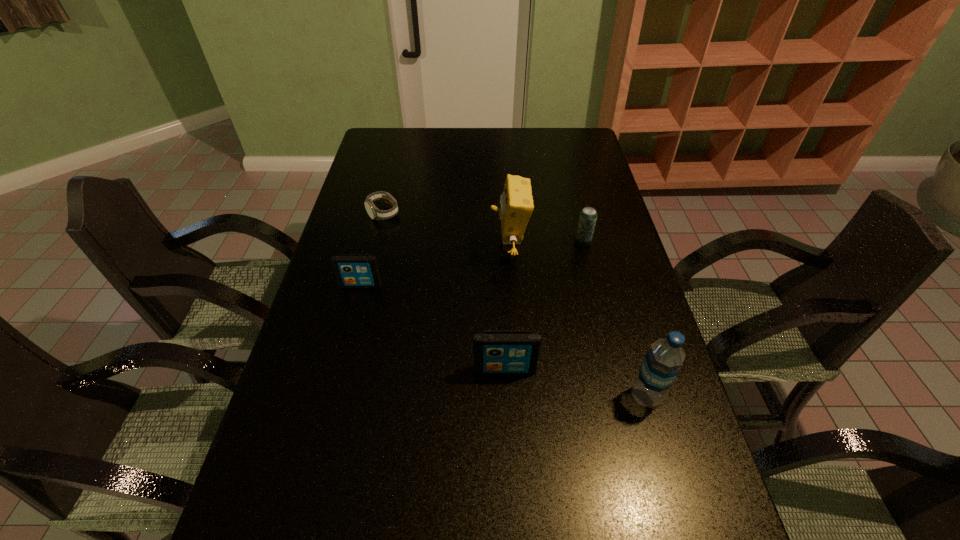
The height and width of the screenshot is (540, 960). I want to click on free point located 0.180m on the back of the beer can, so click(x=573, y=203).

Where is `free point located 0.300m on the face of the sponge`? Image resolution: width=960 pixels, height=540 pixels. free point located 0.300m on the face of the sponge is located at coordinates (392, 251).

You are a GUI agent. You are given a task and a screenshot of the screen. Output one action in this format:
    pyautogui.click(x=<x>, y=<y>)
    Task: Click on the vacant space located on the face of the sponge
    The height and width of the screenshot is (540, 960).
    Given the screenshot: What is the action you would take?
    pyautogui.click(x=366, y=251)

At what (x,y) coordinates should I click in order to perform the action: click on free space located 0.320m on the face of the sponge. Please return your answer as a coordinate pair (x, y). Looking at the image, I should click on (385, 251).

The width and height of the screenshot is (960, 540). I want to click on free space located 0.120m on the face of the watch, so 374,248.

Find the location of a particular element. Image resolution: width=960 pixels, height=540 pixels. vacant region located on the label of the nearest object is located at coordinates pyautogui.click(x=516, y=396).

Where is `free spot located 0.050m on the label of the nearest object`? This screenshot has height=540, width=960. free spot located 0.050m on the label of the nearest object is located at coordinates (608, 396).

Find the location of `vacant space located 0.160m on the label of the nearest object`. vacant space located 0.160m on the label of the nearest object is located at coordinates (560, 396).

The height and width of the screenshot is (540, 960). In order to click on iPod that is positioned at the left edge in this screenshot , I will do `click(352, 270)`.

The height and width of the screenshot is (540, 960). I want to click on watch present at the left edge, so click(375, 214).